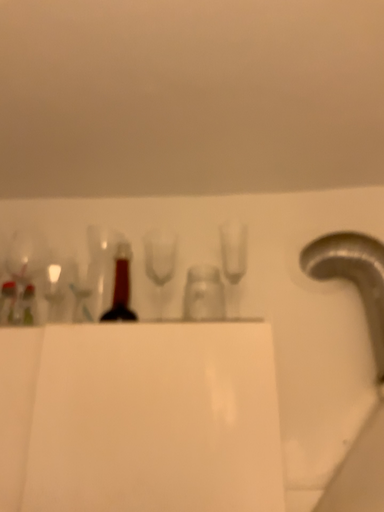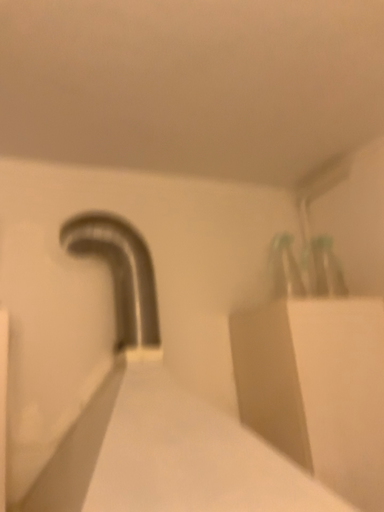
Question: Which way did the camera rotate in the video?

Choices:
 (A) rotated right
 (B) rotated left

Answer: (A)